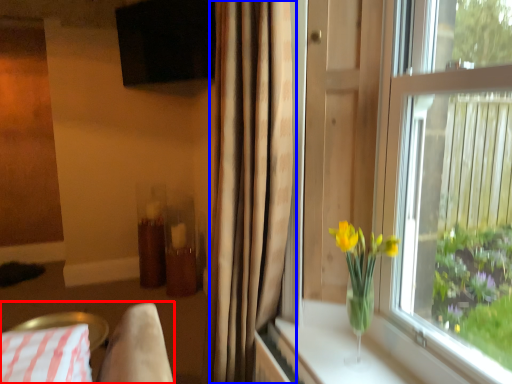
Question: Among these objects, which one is farthest to the camera, bedding (highlighted by a red box) or curtain (highlighted by a blue box)?

Choices:
 (A) bedding
 (B) curtain

Answer: (A)